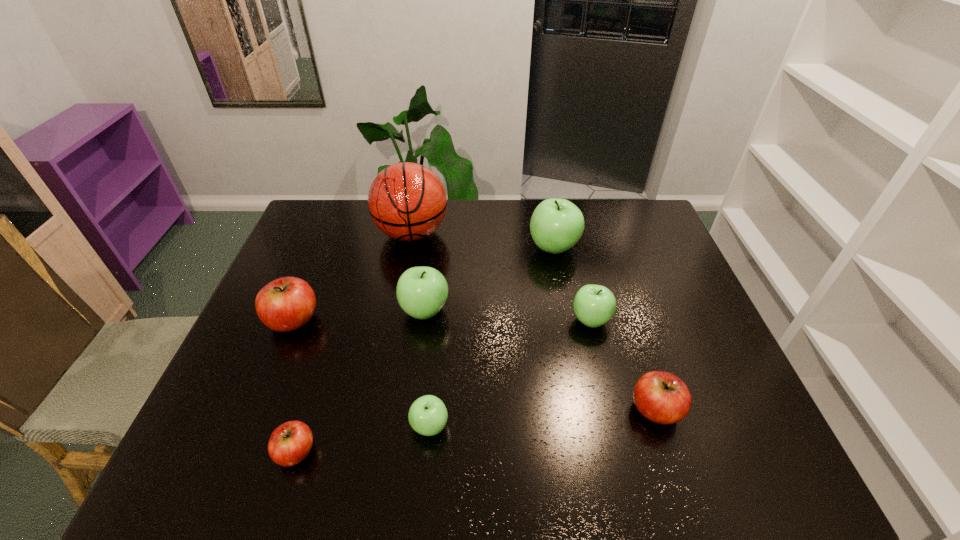
The width and height of the screenshot is (960, 540). In order to click on vacant area that lies between the second smallest green apple and the rightmost red apple in this screenshot , I will do `click(623, 365)`.

The height and width of the screenshot is (540, 960). In order to click on vacant space that's between the second biggest green apple and the third biggest green apple in this screenshot , I will do `click(508, 315)`.

This screenshot has height=540, width=960. Identify the location of free area in between the smallest green apple and the basketball. (420, 330).

Where is `free space that is in between the second smallest green apple and the nearest green apple`? The width and height of the screenshot is (960, 540). free space that is in between the second smallest green apple and the nearest green apple is located at coordinates (510, 373).

The width and height of the screenshot is (960, 540). What are the coordinates of `free point between the smallest red apple and the basketball` in the screenshot? It's located at (354, 343).

The height and width of the screenshot is (540, 960). In order to click on free space between the third biggest green apple and the third smallest green apple in this screenshot , I will do `click(508, 315)`.

Where is `vacant region between the second biggest red apple and the smallest green apple`? vacant region between the second biggest red apple and the smallest green apple is located at coordinates (542, 418).

You are a GUI agent. You are given a task and a screenshot of the screen. Output one action in this format:
    pyautogui.click(x=<x>, y=<y>)
    Task: Click on the vacant area that lies between the sixth apple from right to left and the smallest green apple
    The image size is (960, 540).
    Given the screenshot: What is the action you would take?
    pyautogui.click(x=363, y=439)

Locate an element on the screen. object that is the seventh closest one to the farthest apple is located at coordinates (290, 443).

The width and height of the screenshot is (960, 540). What are the coordinates of `the fourth closest object to the second red apple from left to right` in the screenshot? It's located at (407, 201).